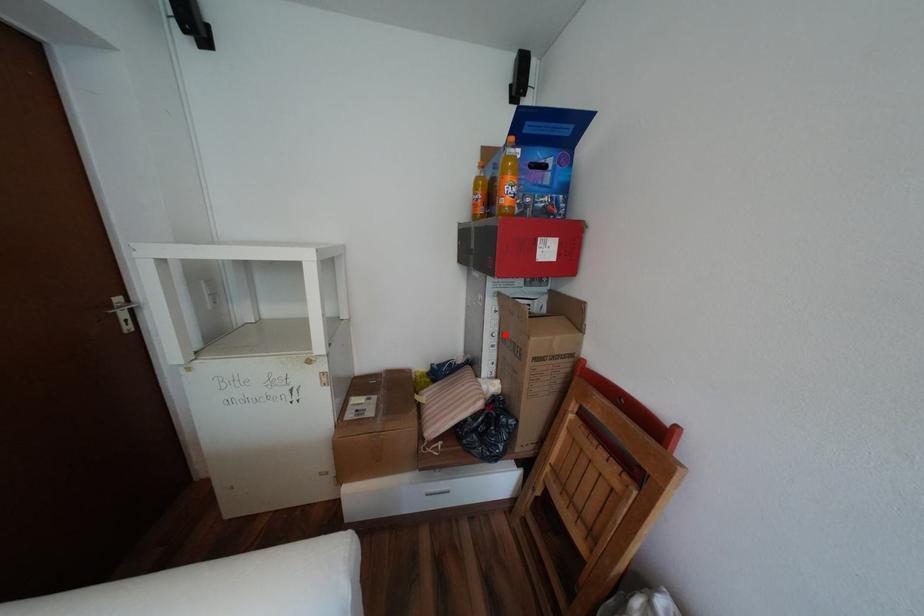
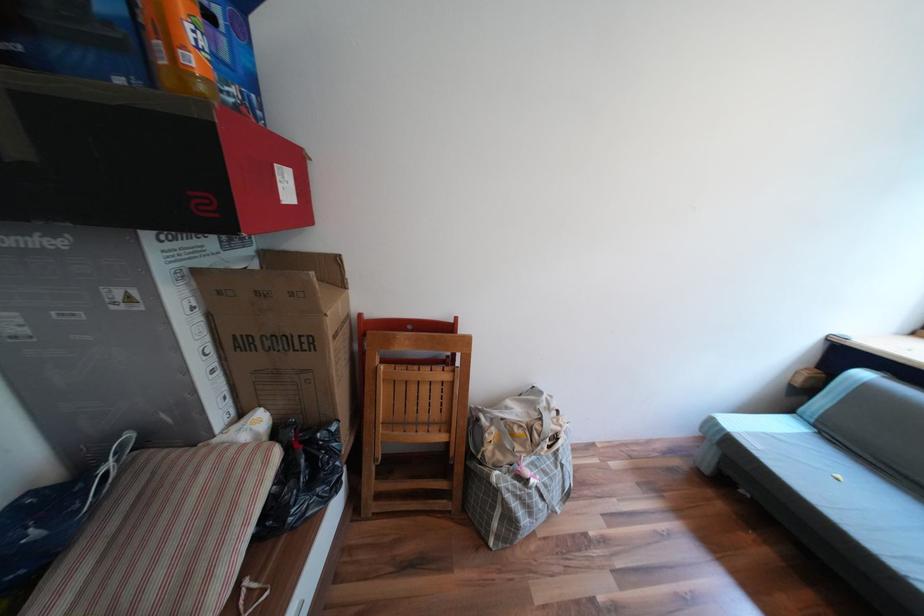
Locate, in the second image, the point that corresponds to the highlighted location in the first image.

(219, 349)